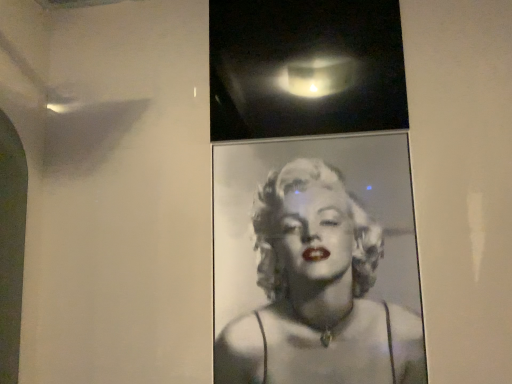
This screenshot has height=384, width=512. I want to click on black glossy portrait at center, so click(318, 292).

Describe the element at coordinates (318, 292) in the screenshot. The image size is (512, 384). I see `black glossy portrait at center` at that location.

Measure the distance between point (331, 356) and camera.

Point (331, 356) and camera are 3.89 feet apart from each other.

Image resolution: width=512 pixels, height=384 pixels. Find the location of `black glossy portrait at center`. black glossy portrait at center is located at coordinates (318, 292).